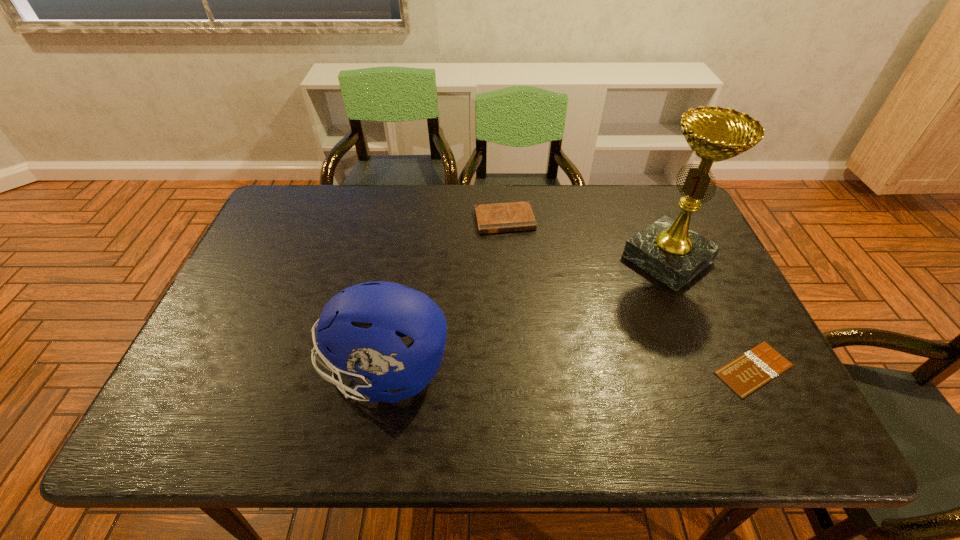
Locate an element on the screen. This screenshot has width=960, height=540. the second closest object to the football helmet is located at coordinates (667, 249).

At what (x,y) coordinates should I click in order to perform the action: click on free region that satisfies the following two spatial constraints: 1. on the front side of the tallest object; 2. on the left side of the second shortest object. Please return your answer as a coordinate pair (x, y). The image size is (960, 540). Looking at the image, I should click on (507, 259).

At what (x,y) coordinates should I click in order to perform the action: click on vacant space that satisfies the following two spatial constraints: 1. on the front side of the diary; 2. on the left side of the tallest object. Please return your answer as a coordinate pair (x, y). The height and width of the screenshot is (540, 960). Looking at the image, I should click on (507, 259).